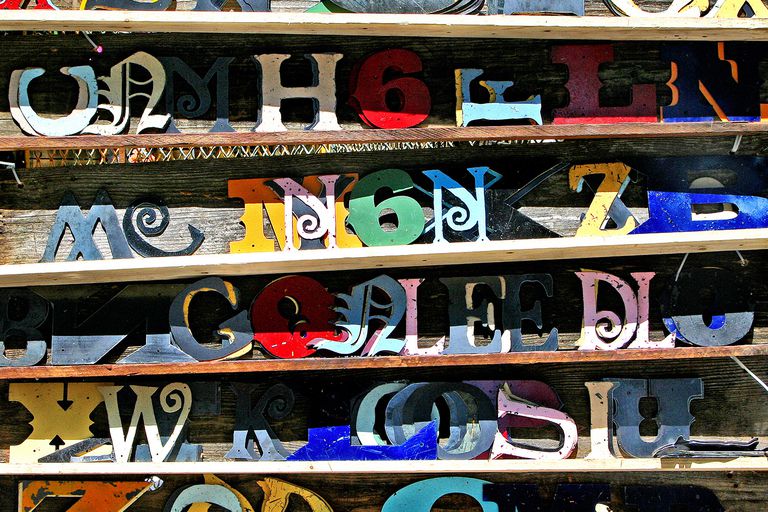
Image resolution: width=768 pixels, height=512 pixels. Find the location of `shelves`. shelves is located at coordinates (222, 24), (224, 137), (232, 259), (222, 364), (239, 471).